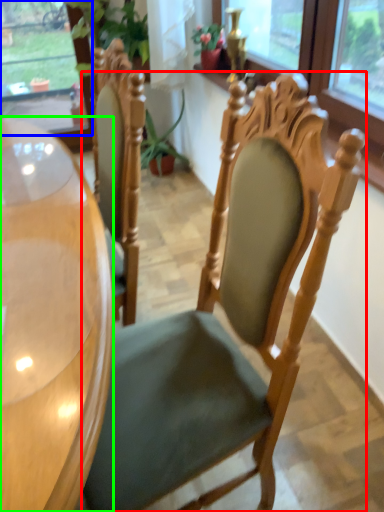
Question: Which object is the farthest from chair (highlighted by a red box)? Choose among these: window (highlighted by a blue box) or desk (highlighted by a green box).

Choices:
 (A) window
 (B) desk

Answer: (A)